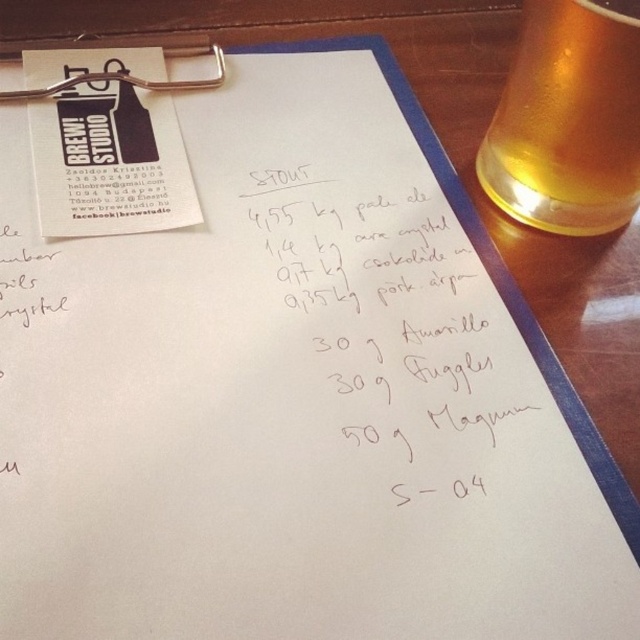
You are a photographer taking a photo of the clipboard. There are two points marked on the clipboard at coordinates point [435,426] and point [616,17]. Which point will appear closer to the center of the photo?

Point [435,426] is closer to the camera than point [616,17], so it will appear closer to the center of the photo.